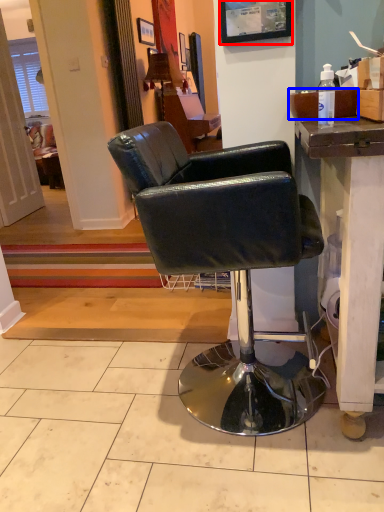
Question: Which object is further to the camera taking this photo, picture frame (highlighted by a red box) or box (highlighted by a blue box)?

Choices:
 (A) picture frame
 (B) box

Answer: (A)